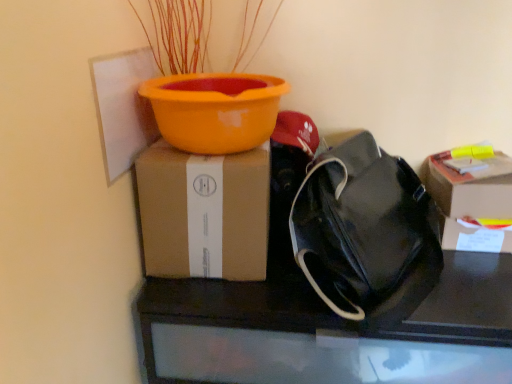
Where is `vacant area that lies between black leather handbag at right and cardboard box at right, arranged as the second box when viewed from the left`? vacant area that lies between black leather handbag at right and cardboard box at right, arranged as the second box when viewed from the left is located at coordinates (461, 287).